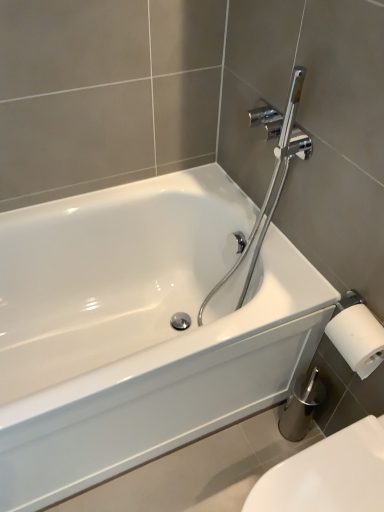
Question: Should I look upward or downward to see white glossy bathtub at center?

Choices:
 (A) up
 (B) down

Answer: (B)

Question: Is white glossy toilet at lower right wider than white glossy bathtub at center?

Choices:
 (A) no
 (B) yes

Answer: (A)

Question: Is white glossy bathtub at center completely or partially inside white glossy toilet at lower right?

Choices:
 (A) no
 (B) yes

Answer: (A)

Question: Considering the relative sizes of white glossy toilet at lower right and white glossy bathtub at center in the image provided, is white glossy toilet at lower right smaller than white glossy bathtub at center?

Choices:
 (A) no
 (B) yes

Answer: (B)

Question: Does white glossy toilet at lower right have a greater height compared to white glossy bathtub at center?

Choices:
 (A) yes
 (B) no

Answer: (B)

Question: From the image's perspective, is white glossy toilet at lower right on white glossy bathtub at center?

Choices:
 (A) yes
 (B) no

Answer: (B)

Question: Could you tell me if white glossy toilet at lower right is facing white glossy bathtub at center?

Choices:
 (A) yes
 (B) no

Answer: (B)

Question: From the image's perspective, does white glossy toilet at lower right appear higher than chrome/polished metal showerhead at upper right?

Choices:
 (A) yes
 (B) no

Answer: (B)

Question: Does white glossy toilet at lower right have a lesser height compared to chrome/polished metal showerhead at upper right?

Choices:
 (A) no
 (B) yes

Answer: (B)

Question: Can you see white glossy toilet at lower right touching chrome/polished metal showerhead at upper right?

Choices:
 (A) no
 (B) yes

Answer: (A)

Question: From the image's perspective, is white glossy toilet at lower right located beneath chrome/polished metal showerhead at upper right?

Choices:
 (A) no
 (B) yes

Answer: (B)

Question: Is the depth of white glossy toilet at lower right greater than that of chrome/polished metal showerhead at upper right?

Choices:
 (A) no
 (B) yes

Answer: (A)

Question: Is white glossy toilet at lower right positioned before chrome/polished metal showerhead at upper right?

Choices:
 (A) no
 (B) yes

Answer: (B)

Question: Is chrome/polished metal showerhead at upper right not inside white glossy toilet at lower right?

Choices:
 (A) no
 (B) yes

Answer: (B)